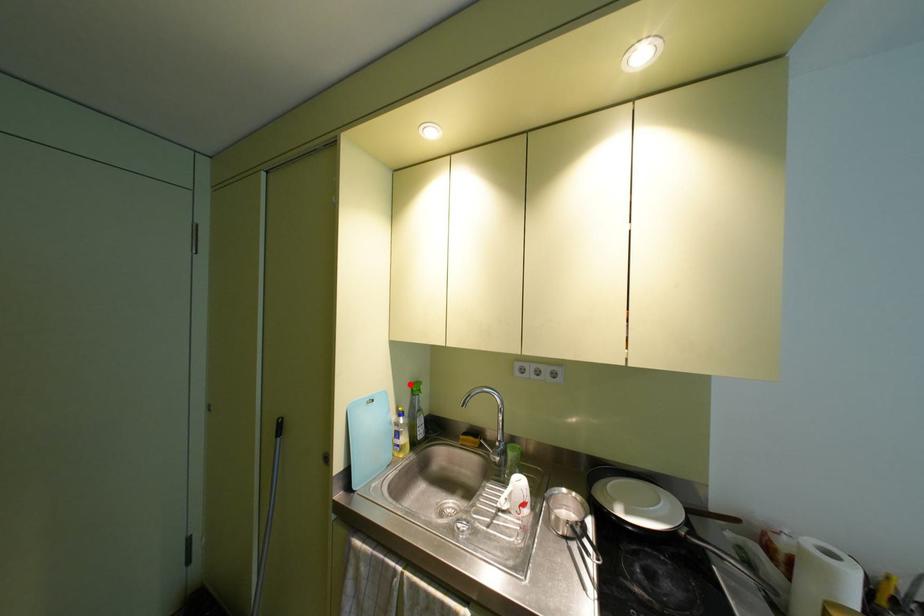
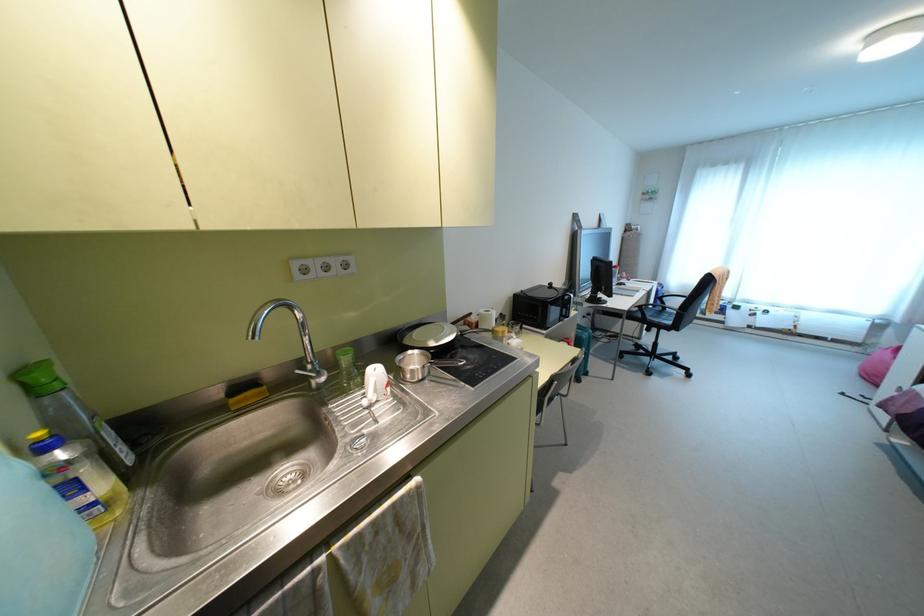
The point at the highlighted location is marked in the first image. Where is the corresponding point in the second image?

(20, 374)